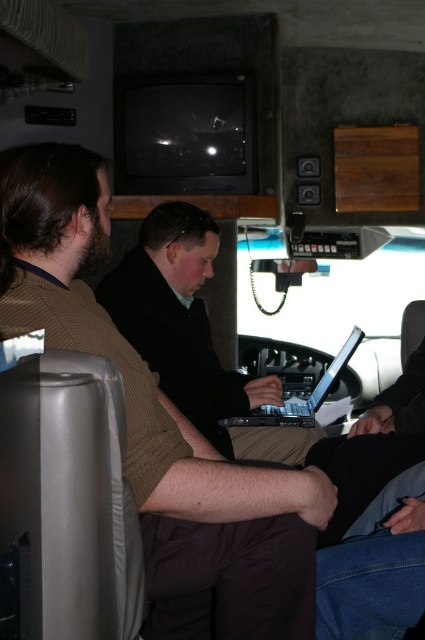
In the scene shown: Between black matte laptop at center and silver metallic laptop at center, which one is positioned lower?

silver metallic laptop at center is below.

In the scene shown: Which of these two, black matte laptop at center or silver metallic laptop at center, stands shorter?

With less height is silver metallic laptop at center.

The width and height of the screenshot is (425, 640). I want to click on black matte laptop at center, so point(192,336).